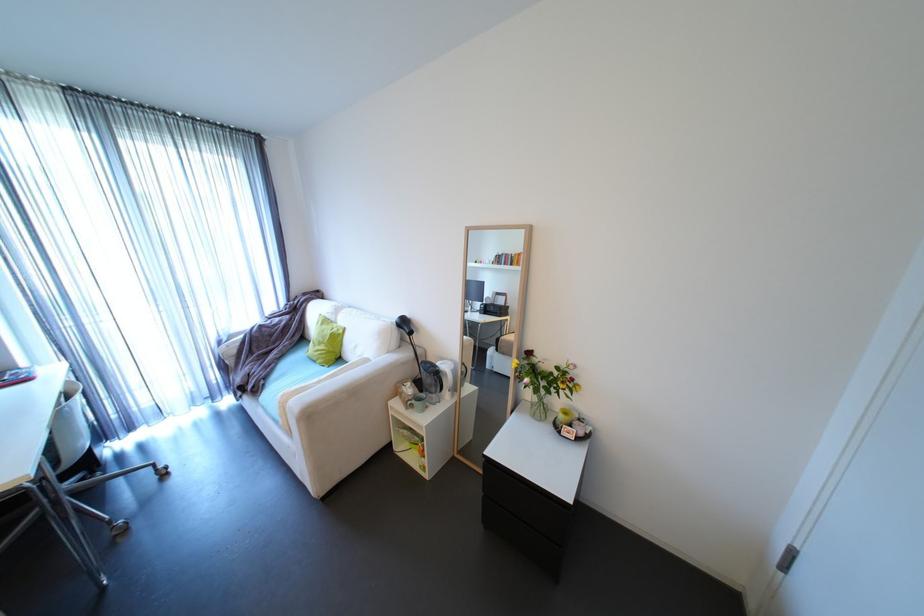
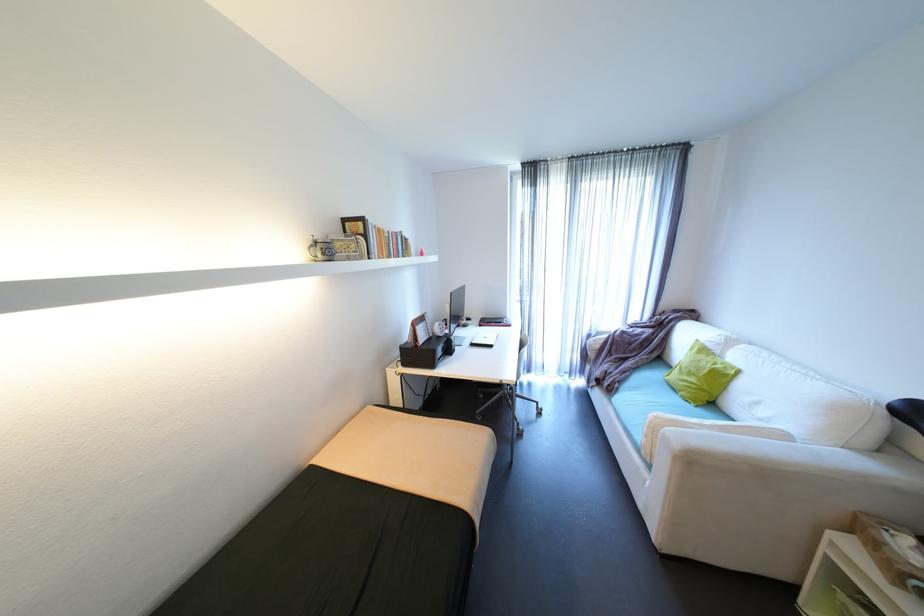
The point at (351, 330) is marked in the first image. Where is the corresponding point in the second image?

(747, 371)